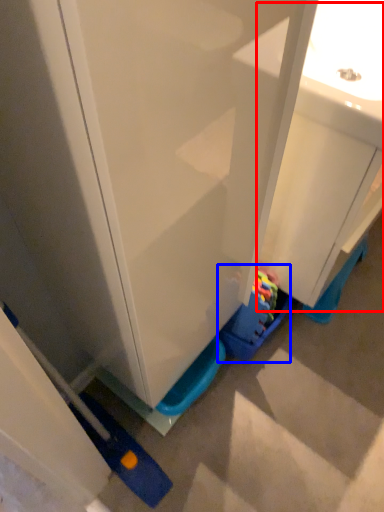
Question: Which object is closer to the camera taking this photo, sink (highlighted by a red box) or toy (highlighted by a blue box)?

Choices:
 (A) sink
 (B) toy

Answer: (A)